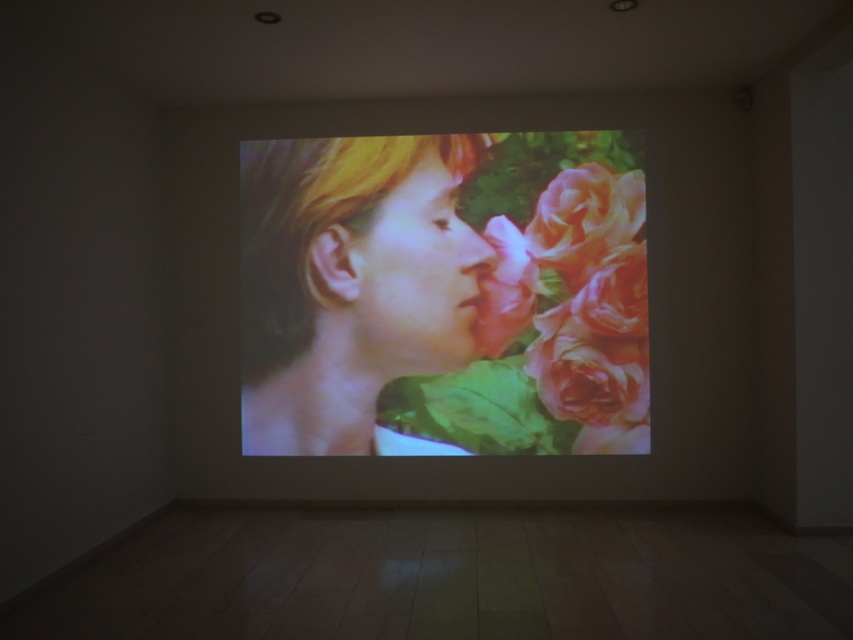
In the scene shown: You are an art curator planning to install a new sculpture in the room. The sculpture requires a space wider than the pink matte rose at center. Can you place it where the smooth skin face at center is currently projected?

The smooth skin face at center is wider than the pink matte rose at center, so yes, the sculpture can be placed there as it requires a space wider than the pink matte rose at center.

You are an art curator planning to install a new sculpture in front of the projection screen. The sculpture will be placed between the smooth skin face at center and the pink matte rose at center shown in the projection. Based on their positions in the image, which object should the sculpture be closer to?

The sculpture should be placed closer to the smooth skin face at center because the pink matte rose at center is positioned behind it, meaning the face is closer to the front of the projection.